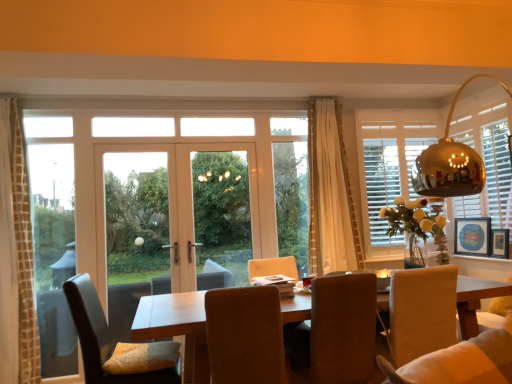
Identify the location of vacant point above clear glass door at center (from a real-world perspective). The image size is (512, 384). (139, 137).